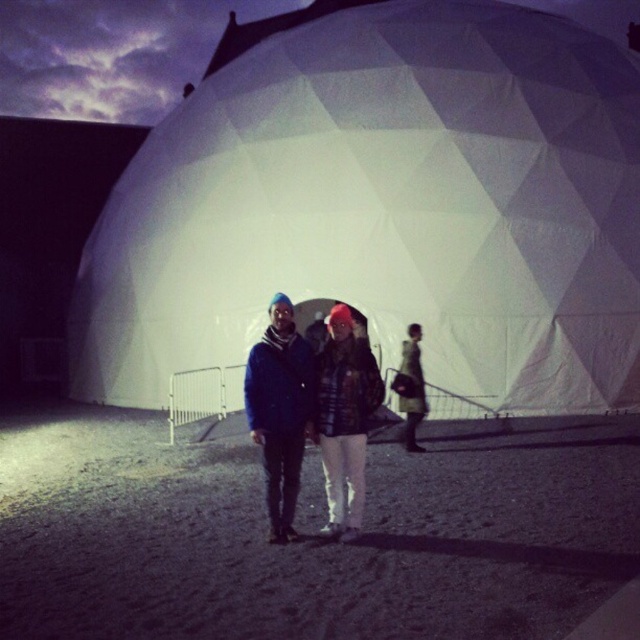
Does point (280, 426) come closer to viewer compared to point (348, 429)?

No, it is behind (348, 429).

Who is higher up, dark blue jacket at center or plaid fabric coat at center?

dark blue jacket at center is higher up.

The height and width of the screenshot is (640, 640). What do you see at coordinates (280, 412) in the screenshot?
I see `dark blue jacket at center` at bounding box center [280, 412].

Image resolution: width=640 pixels, height=640 pixels. Find the location of `dark blue jacket at center`. dark blue jacket at center is located at coordinates [280, 412].

Is white fabric dome at center bigger than dark blue jacket at center?

Yes.

Is white fabric dome at center positioned behind dark blue jacket at center?

Yes.

The height and width of the screenshot is (640, 640). In order to click on white fabric dome at center in this screenshot , I will do `click(385, 208)`.

Can you confirm if white fabric dome at center is smaller than plaid fabric coat at center?

Incorrect, white fabric dome at center is not smaller in size than plaid fabric coat at center.

Which is more to the right, white fabric dome at center or plaid fabric coat at center?

From the viewer's perspective, plaid fabric coat at center appears more on the right side.

This screenshot has width=640, height=640. Find the location of `white fabric dome at center`. white fabric dome at center is located at coordinates (385, 208).